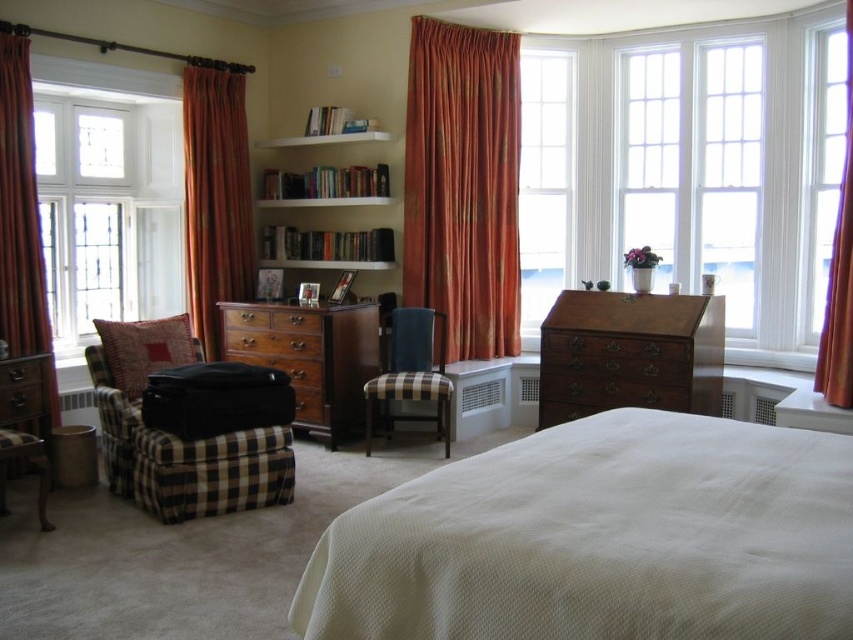
Question: Which of these objects is positioned closest to the clear glass window at center?

Choices:
 (A) matte brown drawer at center
 (B) plaid fabric armchair at lower left
 (C) plush red pillow at left
 (D) brown wood dresser at center

Answer: (D)

Question: Does matte brown drawer at center have a greater width compared to plush red pillow at left?

Choices:
 (A) no
 (B) yes

Answer: (B)

Question: Does brown wood dresser at center have a larger size compared to wooden dresser at left?

Choices:
 (A) no
 (B) yes

Answer: (B)

Question: Is white textured bed at center wider than white glass window at left?

Choices:
 (A) yes
 (B) no

Answer: (A)

Question: Which object appears farthest from the camera in this image?

Choices:
 (A) matte brown drawer at center
 (B) plaid fabric chair at center
 (C) mahogany wooden desk at center
 (D) plaid fabric armchair at lower left

Answer: (A)

Question: Estimate the real-world distances between objects in this image. Which object is closer to the orange textured curtain at center?

Choices:
 (A) white wood bookshelf at center
 (B) plush red pillow at left

Answer: (A)